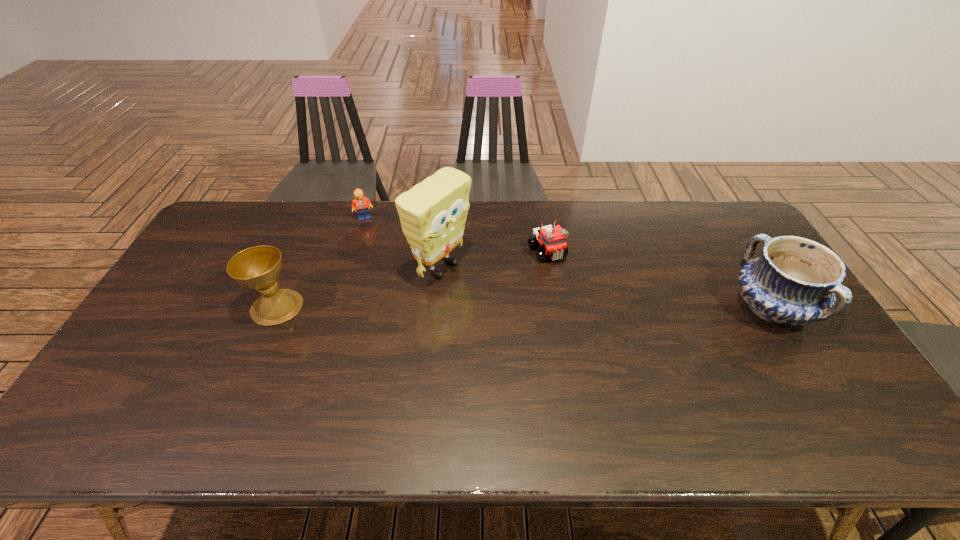
Locate an element on the screen. the leftmost object is located at coordinates (259, 267).

Locate an element on the screen. pottery is located at coordinates (794, 281).

Where is `the tallest object`? The width and height of the screenshot is (960, 540). the tallest object is located at coordinates (433, 213).

Identify the location of sponge. (433, 213).

Image resolution: width=960 pixels, height=540 pixels. In order to click on the nearer Lego in this screenshot , I will do `click(552, 239)`.

Find the location of `the second object from right to left`. the second object from right to left is located at coordinates (552, 239).

Locate an element on the screen. The image size is (960, 540). the second object from left to right is located at coordinates (361, 203).

Where is `the farther Lego`? The image size is (960, 540). the farther Lego is located at coordinates (361, 203).

Identify the location of free space located on the left of the leftmost object. (228, 307).

Find the location of `vacant area situated 0.240m on the back of the rightmost object`. vacant area situated 0.240m on the back of the rightmost object is located at coordinates (722, 229).